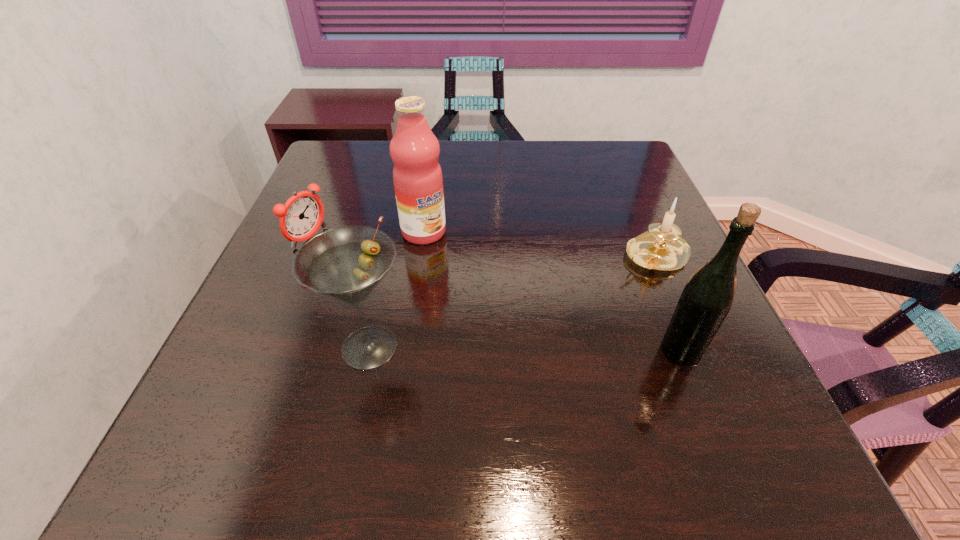
The height and width of the screenshot is (540, 960). In order to click on free space that satisfies the following two spatial constraints: 1. on the front side of the beer bottle; 2. on the left side of the shortest object in this screenshot , I will do `click(261, 350)`.